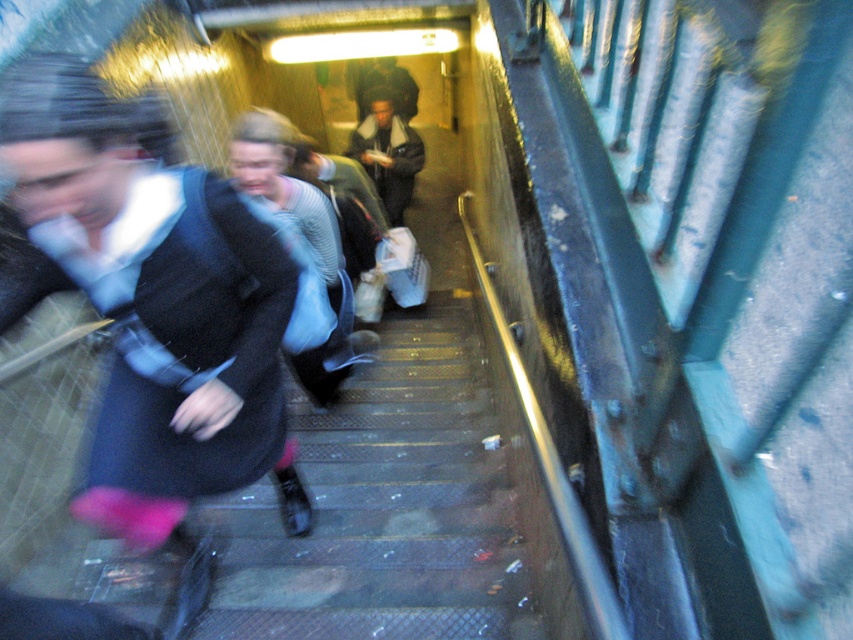
Is dark gray jacket at center bigger than dark brown leather jacket at center?

Incorrect, dark gray jacket at center is not larger than dark brown leather jacket at center.

This screenshot has height=640, width=853. What do you see at coordinates (387, 150) in the screenshot?
I see `dark gray jacket at center` at bounding box center [387, 150].

Consider the image. Who is more forward, (368, 97) or (399, 68)?

Point (368, 97)

Identify the location of dark gray jacket at center. The height and width of the screenshot is (640, 853). (387, 150).

Is the position of metallic gray stairs at center less distant than that of dark brown leather jacket at center?

Yes, it is in front of dark brown leather jacket at center.

Image resolution: width=853 pixels, height=640 pixels. I want to click on metallic gray stairs at center, so click(384, 506).

In order to click on metallic gray stairs at center in this screenshot , I will do `click(384, 506)`.

Does matte black coat at left have a lesser width compared to metallic gray stairs at center?

Indeed, matte black coat at left has a lesser width compared to metallic gray stairs at center.

Does matte black coat at left appear under metallic gray stairs at center?

Actually, matte black coat at left is above metallic gray stairs at center.

At what (x,y) coordinates should I click in order to perform the action: click on matte black coat at left. Please return your answer as a coordinate pair (x, y). The image size is (853, 640). Looking at the image, I should click on (148, 305).

Locate an element on the screen. This screenshot has height=640, width=853. matte black coat at left is located at coordinates (148, 305).